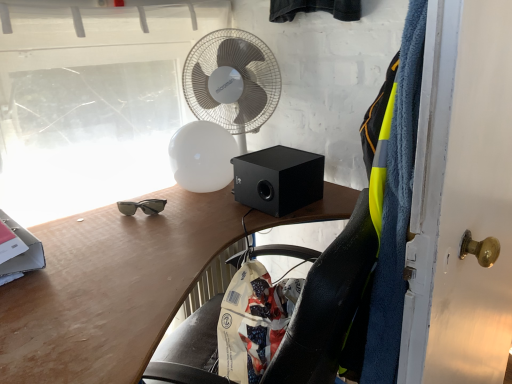
Question: In the image, is black matte speaker at center on the left side or the right side of matte wood desk at center?

Choices:
 (A) right
 (B) left

Answer: (A)

Question: From a real-world perspective, relative to matte wood desk at center, is black matte speaker at center vertically above or below?

Choices:
 (A) below
 (B) above

Answer: (B)

Question: Which is nearer to the black matte speaker at center?

Choices:
 (A) matte wood desk at center
 (B) white plastic mechanical fan at upper center
 (C) white painted wood door at right

Answer: (A)

Question: Considering the real-world distances, which object is closest to the matte wood desk at center?

Choices:
 (A) white plastic mechanical fan at upper center
 (B) white painted wood door at right
 (C) black matte speaker at center

Answer: (C)